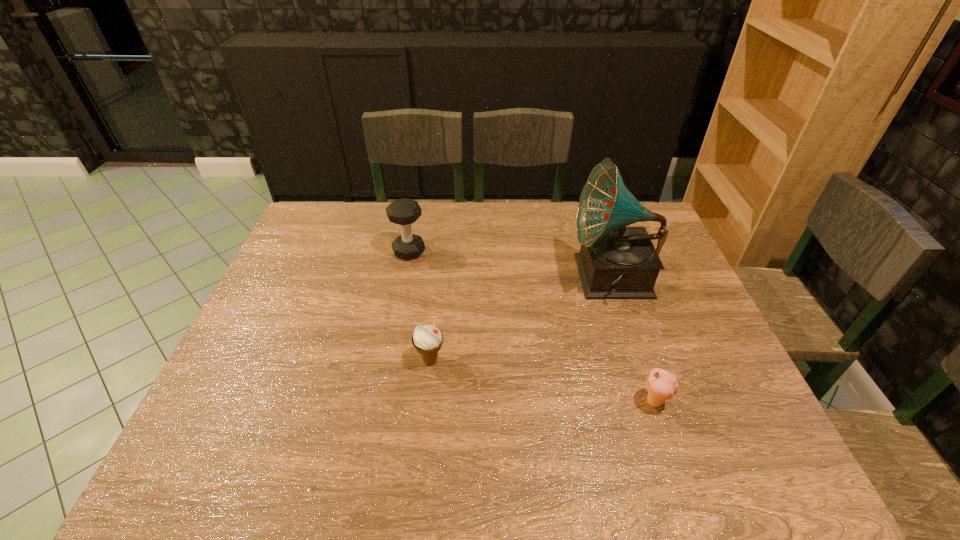
Locate an element on the screen. This screenshot has height=540, width=960. vacant space in between the left icecream and the tallest object is located at coordinates (521, 320).

Where is `the second closest object to the tallest object`? the second closest object to the tallest object is located at coordinates (427, 340).

Select which object is the second closest to the tallest object. Please provide its 2D coordinates. Your answer should be formatted as a tuple, i.e. [(x, y)], where the tuple contains the x and y coordinates of a point satisfying the conditions above.

[(427, 340)]

This screenshot has height=540, width=960. What are the coordinates of `free space that satisfies the following two spatial constraints: 1. on the horn of the nearer icecream; 2. on the right side of the record player` in the screenshot? It's located at (652, 402).

At what (x,y) coordinates should I click in order to perform the action: click on free location that satisfies the following two spatial constraints: 1. on the horn of the record player; 2. on the left side of the nearest object. Please return your answer as a coordinate pair (x, y). This screenshot has width=960, height=540. Looking at the image, I should click on (652, 402).

Find the location of a particular element. blank space that satisfies the following two spatial constraints: 1. on the horn of the tallest object; 2. on the back side of the nearer icecream is located at coordinates (652, 402).